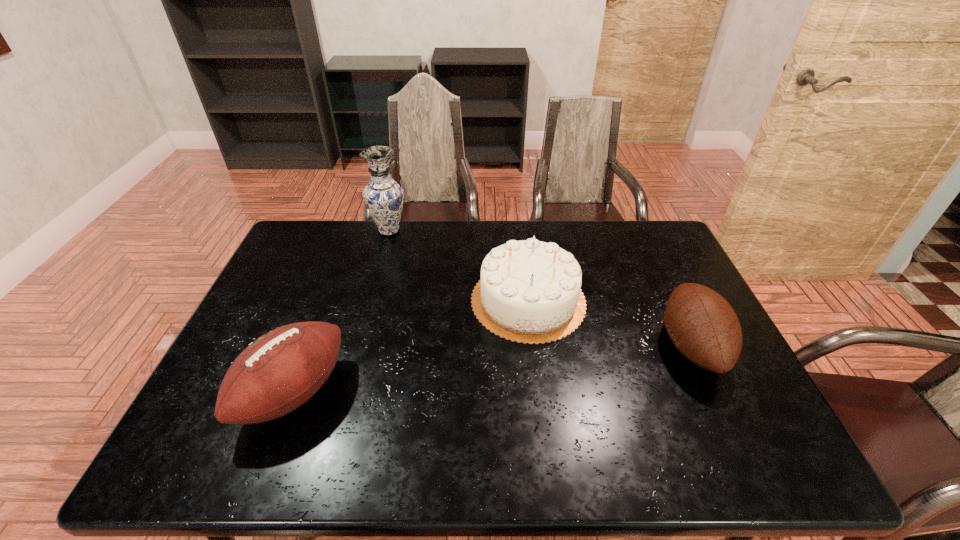
The height and width of the screenshot is (540, 960). In the image, there is a desktop. What are the coordinates of `vacant space at the far left corner` in the screenshot? It's located at (327, 247).

This screenshot has width=960, height=540. Find the location of `free space between the tallest object and the second object from right to left`. free space between the tallest object and the second object from right to left is located at coordinates (459, 266).

Identify the location of vacant area between the left football and the third object from left to right. Image resolution: width=960 pixels, height=540 pixels. (411, 347).

At what (x,y) coordinates should I click in order to perform the action: click on vacant area that lies between the left football and the vase. Please return your answer as a coordinate pair (x, y). This screenshot has height=540, width=960. Looking at the image, I should click on (342, 312).

This screenshot has width=960, height=540. What are the coordinates of `vacant space that is in between the vase and the third object from left to right` in the screenshot? It's located at tap(459, 266).

Locate an element on the screen. This screenshot has height=540, width=960. vacant area that lies between the birthday cake and the left football is located at coordinates (411, 347).

Identify the location of vacant space that is in between the right football and the second object from right to left. The width and height of the screenshot is (960, 540). (610, 323).

Identify the location of vacant space in between the rightmost object and the left football. The width and height of the screenshot is (960, 540). (492, 370).

Find the location of a particular element. free point between the left football and the vase is located at coordinates (342, 312).

Locate which object is the third closest to the tallest object. Please provide its 2D coordinates. Your answer should be formatted as a tuple, i.e. [(x, y)], where the tuple contains the x and y coordinates of a point satisfying the conditions above.

[(703, 326)]